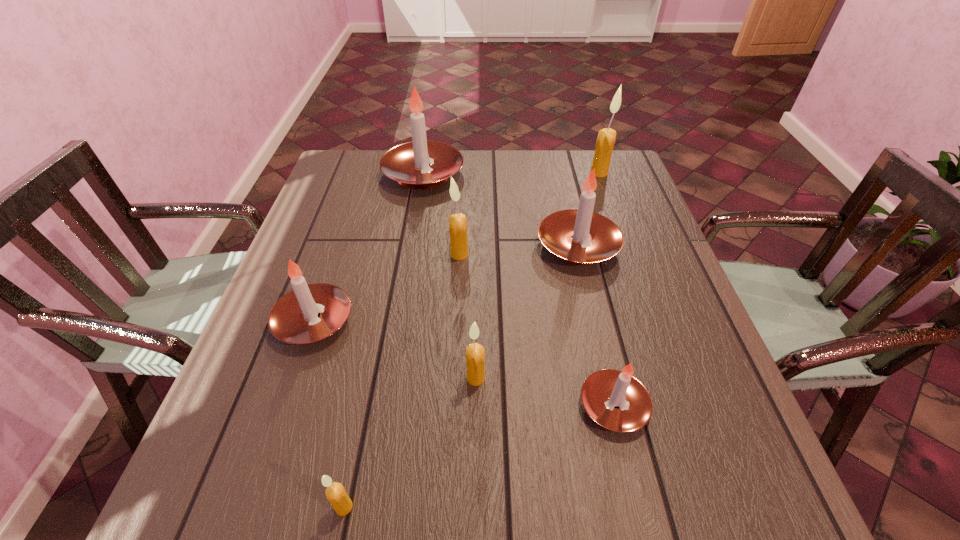
In order to click on vacant space located on the right of the nearest candle in this screenshot , I will do `click(501, 507)`.

This screenshot has width=960, height=540. Find the location of `object at the near edge`. object at the near edge is located at coordinates tap(335, 492).

Find the location of a particular element. This screenshot has height=540, width=960. object that is at the far left corner is located at coordinates (408, 163).

Find the location of a particular element. The image size is (960, 540). object positioned at the far right corner is located at coordinates (605, 142).

The height and width of the screenshot is (540, 960). In order to click on free location at the far edge in this screenshot , I will do `click(522, 151)`.

In the image, there is a desktop. Where is `blank space at the near edge`? The image size is (960, 540). blank space at the near edge is located at coordinates (415, 475).

You are a GUI agent. You are given a task and a screenshot of the screen. Output one action in this format:
    pyautogui.click(x=<x>, y=<y>)
    Task: Click on the free space at the right edge
    
    Given the screenshot: What is the action you would take?
    pyautogui.click(x=687, y=356)

This screenshot has width=960, height=540. Find the location of `free location at the far right corner of the desktop`. free location at the far right corner of the desktop is located at coordinates coord(628,180).

I want to click on free space between the farthest white candle and the nearest white candle, so click(x=518, y=290).

In order to click on vacant space that's between the biggest white candle and the fourth object from right to left in this screenshot , I will do `click(449, 276)`.